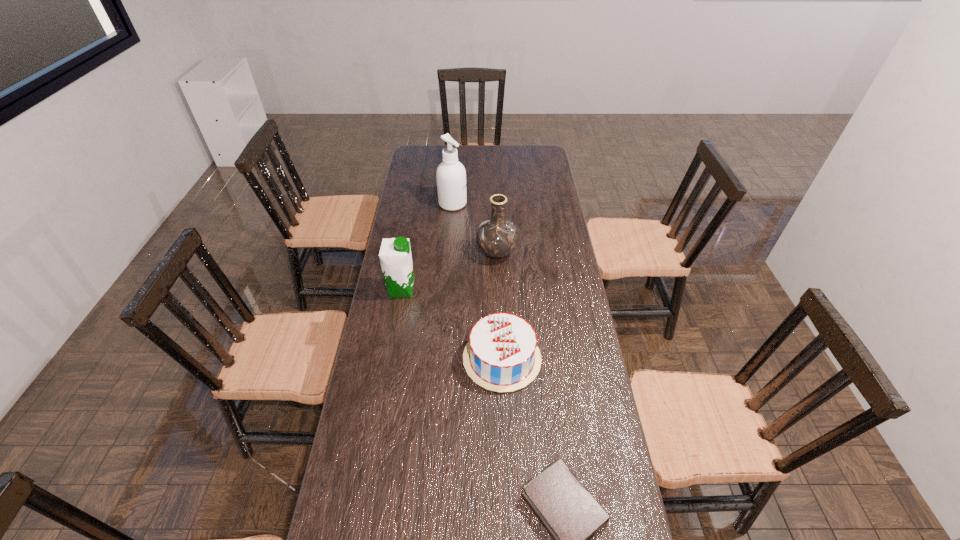
Identify the location of free space between the vase and the third nearest object. (449, 271).

Find the location of `object that is the third closest to the second shortest object`. object that is the third closest to the second shortest object is located at coordinates (497, 237).

Where is `object that stands as the fourth closest to the second farthest object`? The height and width of the screenshot is (540, 960). object that stands as the fourth closest to the second farthest object is located at coordinates (572, 516).

Find the location of a particular element. The image size is (960, 540). vacant space that satisfies the following two spatial constraints: 1. on the front label of the second object from left to right; 2. on the back side of the vase is located at coordinates (449, 253).

Locate an element on the screen. Image resolution: width=960 pixels, height=540 pixels. free spot that satisfies the following two spatial constraints: 1. on the back side of the birthday cake; 2. on the front label of the cleansing agent is located at coordinates (495, 204).

Find the location of `vacant area in the image that satisfies the following two spatial constraints: 1. on the front label of the tallest object; 2. on the left side of the second farthest object`. vacant area in the image that satisfies the following two spatial constraints: 1. on the front label of the tallest object; 2. on the left side of the second farthest object is located at coordinates (449, 253).

Find the location of a particular element. The width and height of the screenshot is (960, 540). free space that satisfies the following two spatial constraints: 1. on the front-facing side of the leftmost object; 2. on the back side of the birthday cake is located at coordinates (390, 359).

The height and width of the screenshot is (540, 960). Identify the location of vacant space that satisfies the following two spatial constraints: 1. on the front label of the vase; 2. on the left side of the fourth object from right to left. (449, 253).

This screenshot has height=540, width=960. I want to click on free point that satisfies the following two spatial constraints: 1. on the front label of the cleansing agent; 2. on the back side of the fourth nearest object, so tap(449, 253).

The width and height of the screenshot is (960, 540). I want to click on vacant point that satisfies the following two spatial constraints: 1. on the front label of the tallest object; 2. on the left side of the fourth nearest object, so click(449, 253).